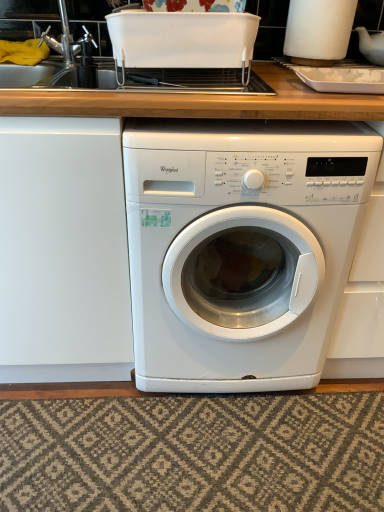
Question: Is white glossy washing machine at center looking in the opposite direction of brushed metal sink at upper left?

Choices:
 (A) yes
 (B) no

Answer: (B)

Question: Is white glossy washing machine at center to the left of brushed metal sink at upper left from the viewer's perspective?

Choices:
 (A) yes
 (B) no

Answer: (B)

Question: Considering the relative sizes of white glossy washing machine at center and brushed metal sink at upper left in the image provided, is white glossy washing machine at center thinner than brushed metal sink at upper left?

Choices:
 (A) no
 (B) yes

Answer: (A)

Question: Would you say brushed metal sink at upper left is part of white glossy washing machine at center's contents?

Choices:
 (A) yes
 (B) no

Answer: (B)

Question: Does white glossy washing machine at center lie in front of brushed metal sink at upper left?

Choices:
 (A) yes
 (B) no

Answer: (A)

Question: From the image's perspective, is white glossy washing machine at center over brushed metal sink at upper left?

Choices:
 (A) yes
 (B) no

Answer: (B)

Question: Is white glossy washing machine at center behind textured beige rug at lower center?

Choices:
 (A) no
 (B) yes

Answer: (A)

Question: Is white glossy washing machine at center placed right next to textured beige rug at lower center?

Choices:
 (A) no
 (B) yes

Answer: (A)

Question: Is white glossy washing machine at center wider than textured beige rug at lower center?

Choices:
 (A) yes
 (B) no

Answer: (A)

Question: Is white glossy washing machine at center aimed at textured beige rug at lower center?

Choices:
 (A) no
 (B) yes

Answer: (B)

Question: Considering the relative positions of white glossy washing machine at center and textured beige rug at lower center in the image provided, is white glossy washing machine at center in front of textured beige rug at lower center?

Choices:
 (A) yes
 (B) no

Answer: (A)

Question: From a real-world perspective, is white glossy washing machine at center physically above textured beige rug at lower center?

Choices:
 (A) no
 (B) yes

Answer: (B)

Question: From the image's perspective, is textured beige rug at lower center on top of white glossy washing machine at center?

Choices:
 (A) no
 (B) yes

Answer: (A)